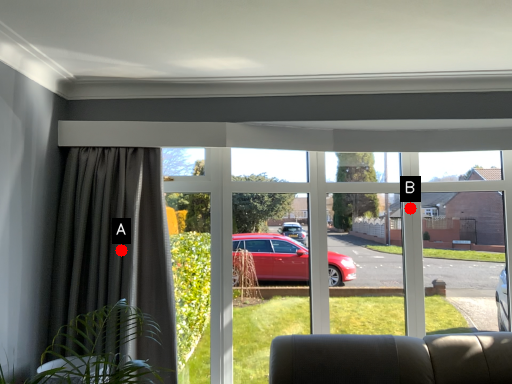
Question: Two points are circled on the image, labeled by A and B beside each circle. Which of the following is the closest to the observer?

Choices:
 (A) A is closer
 (B) B is closer

Answer: (A)